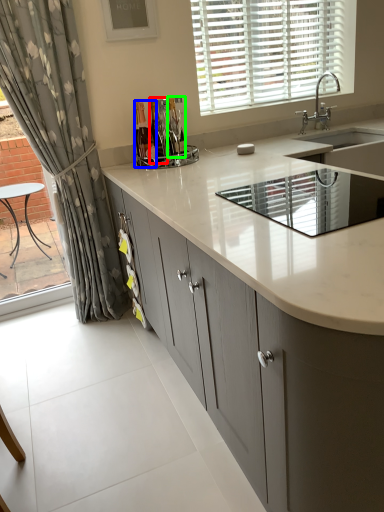
Question: Considering the real-world distances, which object is closest to bottle (highlighted by a red box)? bottle (highlighted by a blue box) or bottle (highlighted by a green box).

Choices:
 (A) bottle
 (B) bottle

Answer: (A)